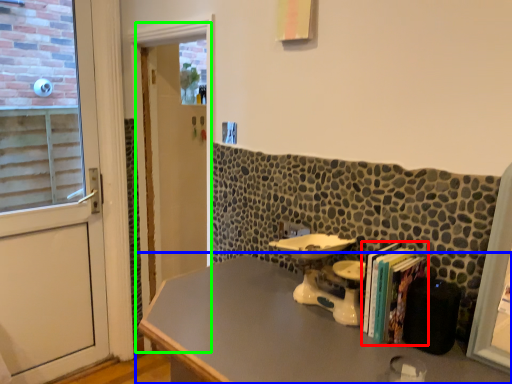
Question: Which object is the closest to the book (highlighted by a red box)? Choose among these: table (highlighted by a blue box) or screen door (highlighted by a green box).

Choices:
 (A) table
 (B) screen door

Answer: (A)